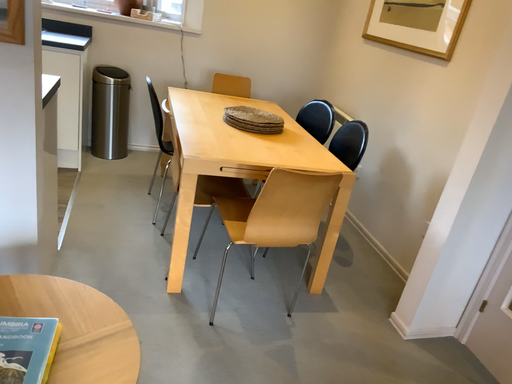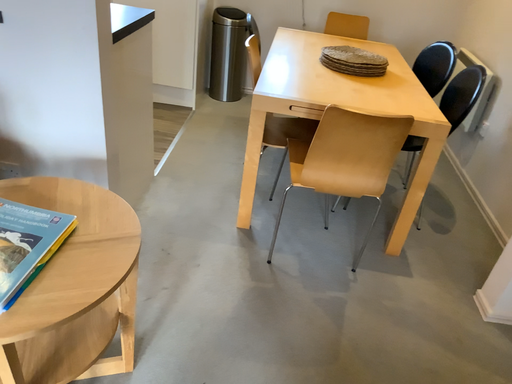
Question: How did the camera likely rotate when shooting the video?

Choices:
 (A) rotated right
 (B) rotated left

Answer: (B)